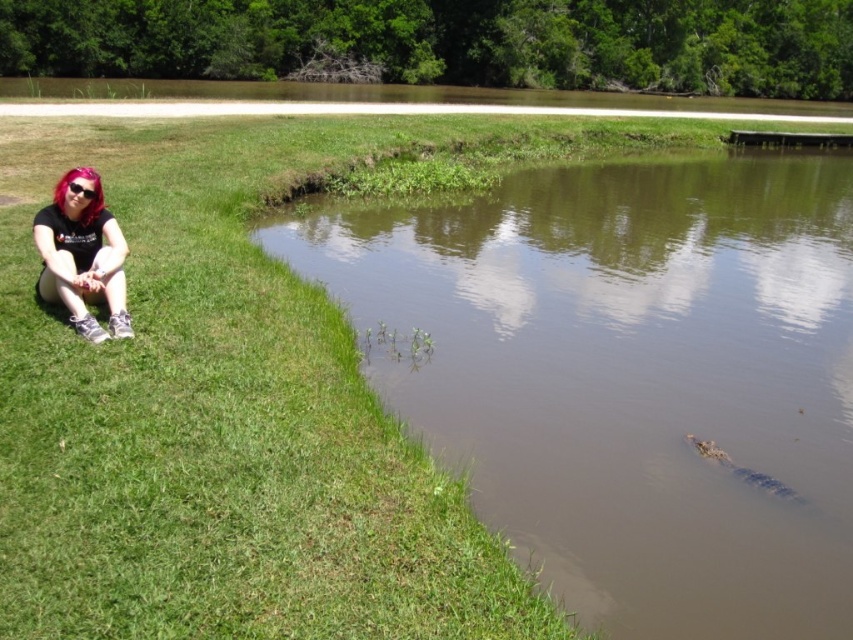
Question: Which object is farther from the camera taking this photo?

Choices:
 (A) brown muddy water at lower left
 (B) sunglasses at left

Answer: (B)

Question: Which object is the closest to the brown muddy water at lower left?

Choices:
 (A) sunglasses at left
 (B) matte black hair at lower left

Answer: (B)

Question: Estimate the real-world distances between objects in this image. Which object is farther from the matte black hair at lower left?

Choices:
 (A) sunglasses at left
 (B) brown muddy water at lower left

Answer: (B)

Question: Can you confirm if brown muddy water at lower left is positioned above matte black hair at lower left?

Choices:
 (A) yes
 (B) no

Answer: (A)

Question: Can you confirm if brown muddy water at lower left is thinner than matte black hair at lower left?

Choices:
 (A) no
 (B) yes

Answer: (A)

Question: Does brown muddy water at lower left appear on the left side of sunglasses at left?

Choices:
 (A) yes
 (B) no

Answer: (B)